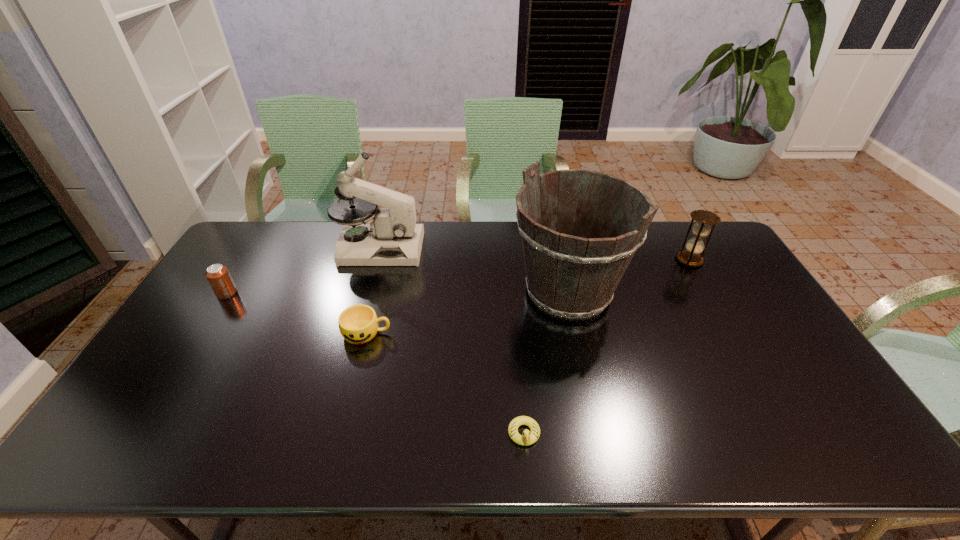
The width and height of the screenshot is (960, 540). In order to click on object at the far right corner in this screenshot , I will do `click(690, 257)`.

The width and height of the screenshot is (960, 540). In the image, there is a desktop. Find the location of `vacant space at the far edge`. vacant space at the far edge is located at coordinates (330, 249).

You are a GUI agent. You are given a task and a screenshot of the screen. Output one action in this format:
    pyautogui.click(x=<x>, y=<y>)
    Task: Click on the free location at the near edge of the desktop
    This screenshot has height=540, width=960.
    Given the screenshot: What is the action you would take?
    pyautogui.click(x=234, y=430)

The width and height of the screenshot is (960, 540). I want to click on free space at the left edge of the desktop, so click(x=148, y=370).

Locate an element on the screen. This screenshot has height=540, width=960. vacant area at the right edge is located at coordinates (724, 319).

This screenshot has height=540, width=960. Find the location of `vacant space at the far left corner of the desktop`. vacant space at the far left corner of the desktop is located at coordinates (279, 231).

The width and height of the screenshot is (960, 540). Identify the location of vacant area that lies between the rightmost object and the fourth tallest object. tap(458, 276).

Find the location of a particular element. The height and width of the screenshot is (540, 960). vacant area that lies between the microscope and the second shortest object is located at coordinates 373,291.

At what (x,y) coordinates should I click in order to perform the action: click on free space between the microscope and the second shortest object. Please return your answer as a coordinate pair (x, y). The width and height of the screenshot is (960, 540). Looking at the image, I should click on (373, 291).

Image resolution: width=960 pixels, height=540 pixels. I want to click on empty space between the microscope and the nearest object, so click(452, 341).